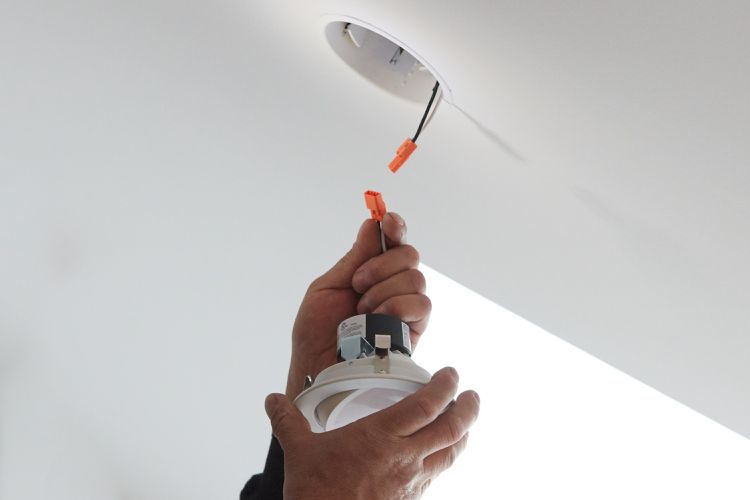
You are a GUI agent. You are given a task and a screenshot of the screen. Output one action in this format:
    pyautogui.click(x=<x>, y=<y>)
    Task: Click on the black cord
    This screenshot has height=500, width=750.
    Given the screenshot: What is the action you would take?
    pyautogui.click(x=424, y=116)